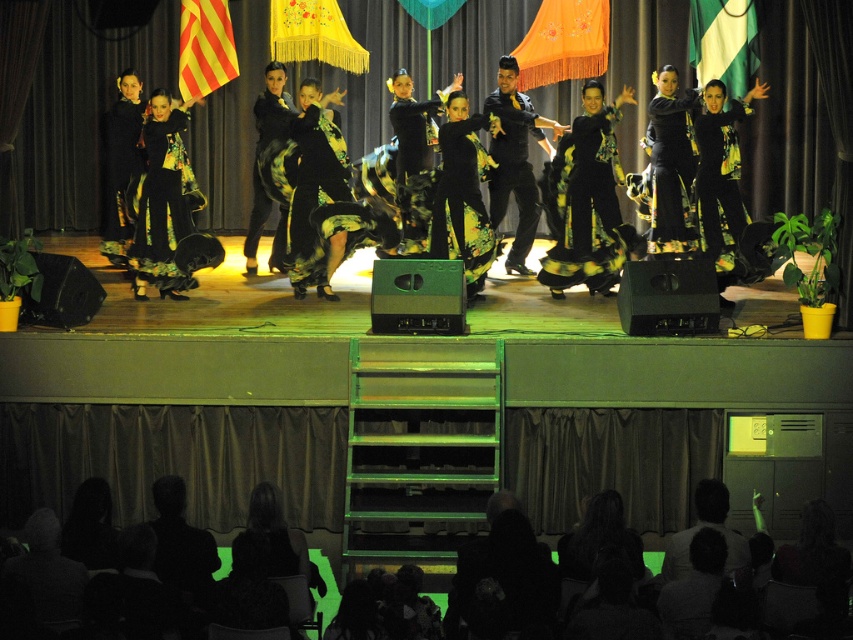
Does black satin dress at center have a greater width compared to black floral dress at center?

Indeed, black satin dress at center has a greater width compared to black floral dress at center.

Between point (622, 92) and point (482, 204), which one is positioned behind?

Point (482, 204)

Locate an element on the screen. This screenshot has height=640, width=853. black satin dress at center is located at coordinates (589, 200).

Is black satin dress at center shorter than black matte suit at center?

Yes, black satin dress at center is shorter than black matte suit at center.

Who is higher up, black satin dress at center or black matte suit at center?

Positioned higher is black matte suit at center.

Between point (585, 136) and point (534, 224), which one is positioned behind?

The point (534, 224) is more distant.

Find the location of a particular element. Image resolution: width=853 pixels, height=640 pixels. black satin dress at center is located at coordinates (589, 200).

Is point (456, 193) positioned in front of point (515, 124)?

That is True.

The width and height of the screenshot is (853, 640). What do you see at coordinates (462, 192) in the screenshot?
I see `black floral dress at center` at bounding box center [462, 192].

Which is behind, point (451, 204) or point (496, 170)?

The point (496, 170) is more distant.

The image size is (853, 640). What are the coordinates of `black floral dress at center` in the screenshot? It's located at (462, 192).